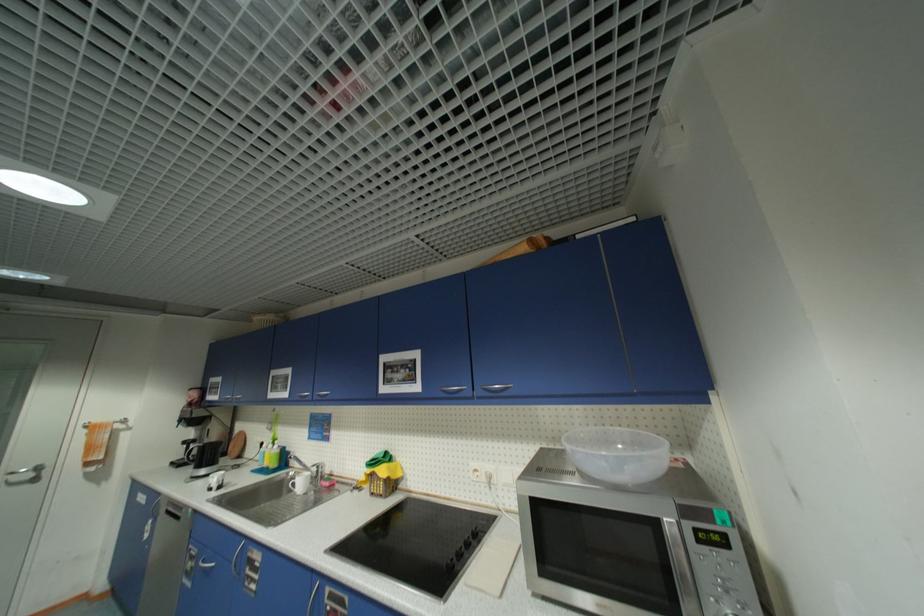
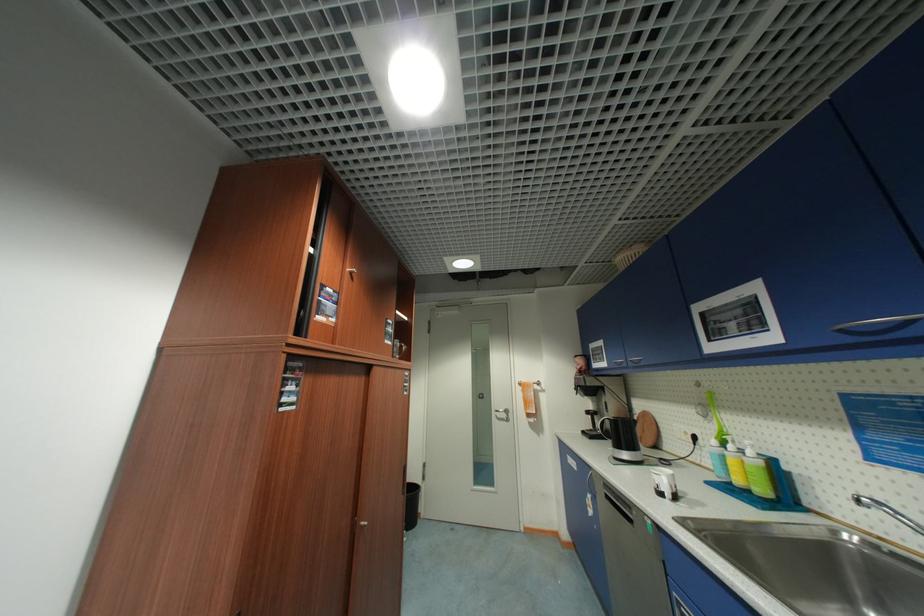
Find the pixel in the second image that matches (215,490) in the first image.

(666, 495)